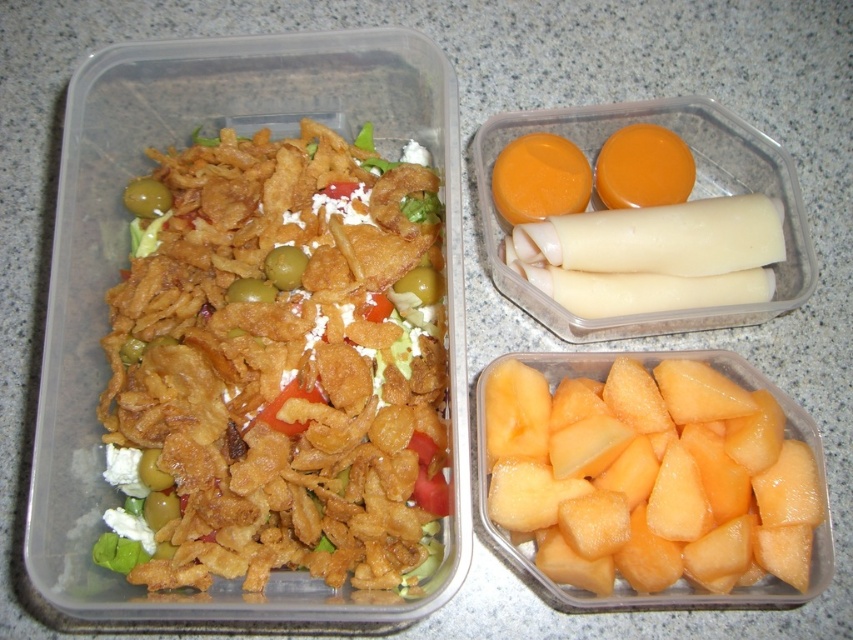
Question: Can you confirm if golden crispy chips at center is positioned above yellowish-orange flesh at lower right?

Choices:
 (A) no
 (B) yes

Answer: (B)

Question: Which of the following is the farthest from the observer?

Choices:
 (A) (363, 189)
 (B) (749, 497)

Answer: (A)

Question: Is golden crispy chips at center behind yellowish-orange flesh at lower right?

Choices:
 (A) yes
 (B) no

Answer: (B)

Question: Is golden crispy chips at center above yellowish-orange flesh at lower right?

Choices:
 (A) yes
 (B) no

Answer: (A)

Question: Among these points, which one is nearest to the camera?

Choices:
 (A) (158, 177)
 (B) (660, 474)

Answer: (B)